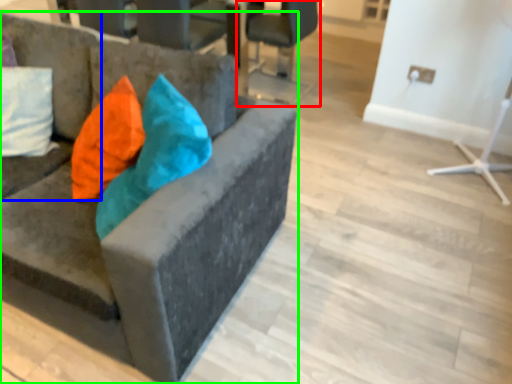
Question: Considering the real-world distances, which object is closest to chair (highlighted by a red box)? studio couch (highlighted by a blue box) or chair (highlighted by a green box).

Choices:
 (A) studio couch
 (B) chair

Answer: (A)